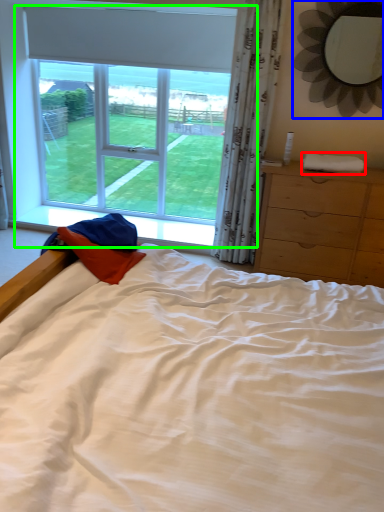
Question: Based on their relative distances, which object is nearer to cloth (highlighted by a red box)? Choose from mirror (highlighted by a blue box) and window (highlighted by a green box).

Choices:
 (A) mirror
 (B) window

Answer: (A)